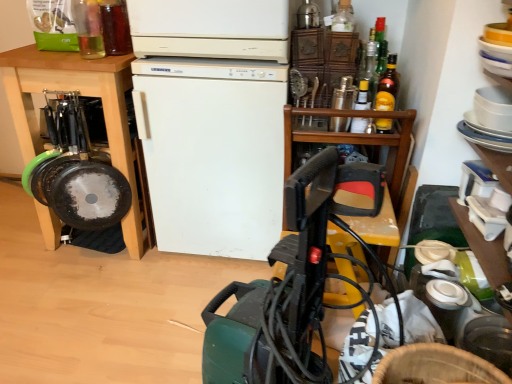
Question: Can you confirm if translucent glass bottle at upper right, which is the 2th bottle from right to left, is thinner than clear glass bottle at upper left, acting as the sixth bottle starting from the right?

Choices:
 (A) no
 (B) yes

Answer: (B)

Question: Considering the relative sizes of translucent glass bottle at upper right, which is the 2th bottle from right to left, and clear glass bottle at upper left, which appears as the first bottle when viewed from the left, in the image provided, is translucent glass bottle at upper right, which is the 2th bottle from right to left, smaller than clear glass bottle at upper left, which appears as the first bottle when viewed from the left,?

Choices:
 (A) yes
 (B) no

Answer: (A)

Question: Is translucent glass bottle at upper right, which ranks as the fifth bottle in left-to-right order, positioned behind clear glass bottle at upper left, which appears as the first bottle when viewed from the left?

Choices:
 (A) no
 (B) yes

Answer: (B)

Question: Can you confirm if translucent glass bottle at upper right, which is the 2th bottle from right to left, is wider than clear glass bottle at upper left, acting as the sixth bottle starting from the right?

Choices:
 (A) yes
 (B) no

Answer: (B)

Question: Is translucent glass bottle at upper right, which ranks as the fifth bottle in left-to-right order, positioned with its back to clear glass bottle at upper left, which appears as the first bottle when viewed from the left?

Choices:
 (A) yes
 (B) no

Answer: (B)

Question: Looking at their shapes, would you say translucent glass bottle at upper left, the fifth bottle in the right-to-left sequence, is wider or thinner than clear glass bottle at upper left, acting as the sixth bottle starting from the right?

Choices:
 (A) wide
 (B) thin

Answer: (B)

Question: Is translucent glass bottle at upper left, placed as the second bottle when sorted from left to right, bigger or smaller than clear glass bottle at upper left, which appears as the first bottle when viewed from the left?

Choices:
 (A) big
 (B) small

Answer: (B)

Question: Is point (126, 46) closer or farther from the camera than point (92, 34)?

Choices:
 (A) closer
 (B) farther

Answer: (A)

Question: Is translucent glass bottle at upper left, placed as the second bottle when sorted from left to right, to the left or to the right of clear glass bottle at upper left, which appears as the first bottle when viewed from the left, in the image?

Choices:
 (A) left
 (B) right

Answer: (B)

Question: Based on their sizes in the image, would you say yellow glass bottle at upper center, the 4th bottle when ordered from left to right, is bigger or smaller than wooden at upper right?

Choices:
 (A) big
 (B) small

Answer: (B)

Question: Is yellow glass bottle at upper center, the 4th bottle when ordered from left to right, taller or shorter than wooden at upper right?

Choices:
 (A) tall
 (B) short

Answer: (B)

Question: From a real-world perspective, is yellow glass bottle at upper center, arranged as the third bottle when viewed from the right, positioned above or below wooden at upper right?

Choices:
 (A) below
 (B) above

Answer: (B)

Question: Is point click(x=367, y=94) closer or farther from the camera than point click(x=291, y=109)?

Choices:
 (A) farther
 (B) closer

Answer: (B)

Question: From the image's perspective, relative to white matte refrigerator at center, is translucent glass bottle at upper right, which ranks as the fifth bottle in left-to-right order, above or below?

Choices:
 (A) above
 (B) below

Answer: (A)

Question: From a real-world perspective, is translucent glass bottle at upper right, which is the 2th bottle from right to left, physically located above or below white matte refrigerator at center?

Choices:
 (A) above
 (B) below

Answer: (A)